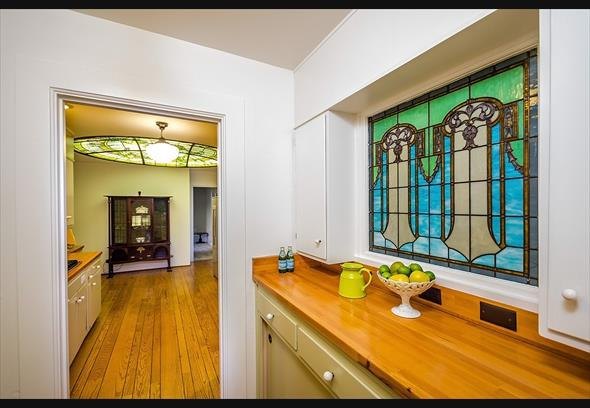
Find the location of a particular element. glass is located at coordinates (414, 227).